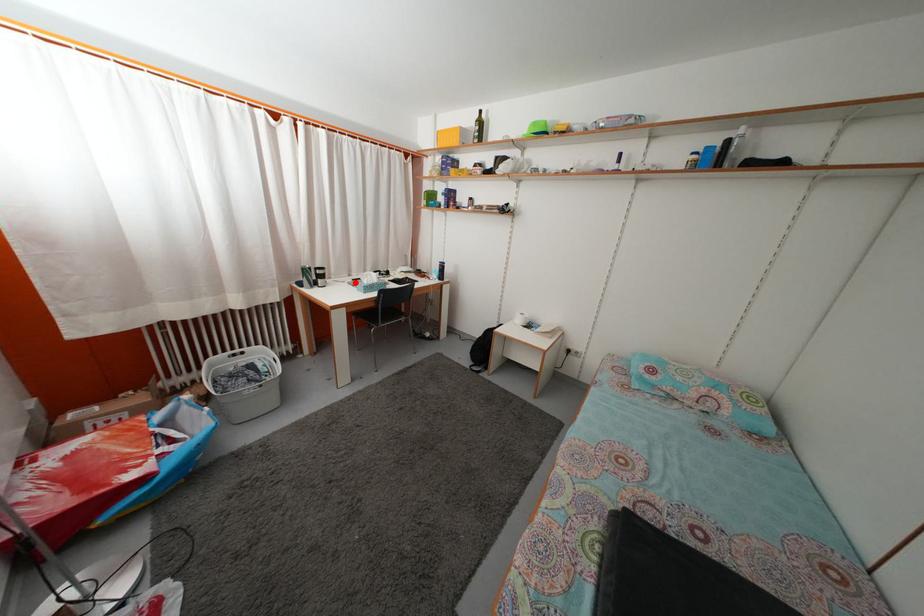
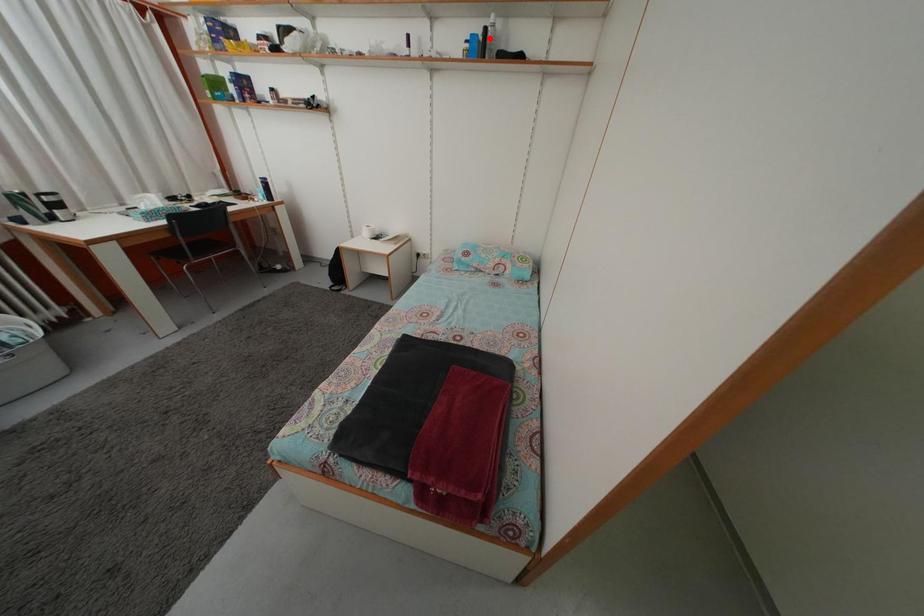
I am providing you with two images of the same scene from different viewpoints. A red point is marked on the first image and another point is marked on the second image. Are the points marked in image1 and image2 representing the same 3D position?

No